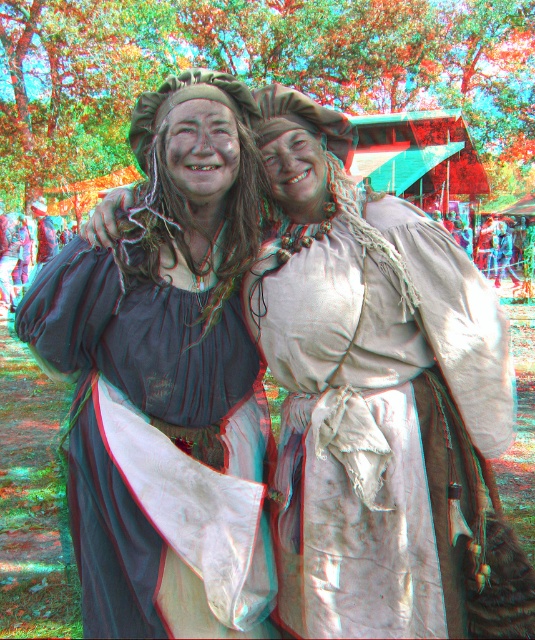
Question: Does matte beige dress at center appear on the right side of matte black dress at center?

Choices:
 (A) no
 (B) yes

Answer: (B)

Question: Which object is farther from the camera taking this photo?

Choices:
 (A) matte black dress at center
 (B) matte beige dress at center

Answer: (B)

Question: Can you confirm if matte beige dress at center is thinner than matte black dress at center?

Choices:
 (A) yes
 (B) no

Answer: (B)

Question: Among these objects, which one is farthest from the camera?

Choices:
 (A) matte beige dress at center
 (B) matte black dress at center

Answer: (A)

Question: Which object is farther from the camera taking this photo?

Choices:
 (A) matte beige dress at center
 (B) matte black dress at center

Answer: (A)

Question: Can you confirm if matte beige dress at center is wider than matte black dress at center?

Choices:
 (A) no
 (B) yes

Answer: (B)